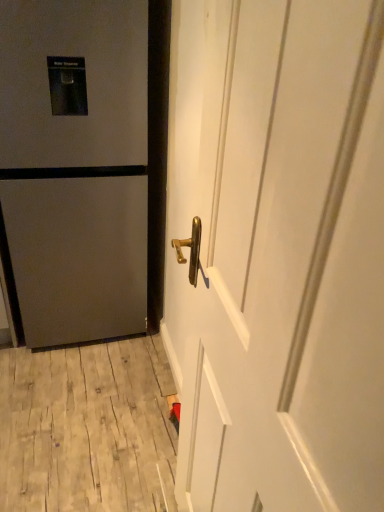
Find the location of a particular element. vacant space situated above wooden at lower left (from a real-world perspective) is located at coordinates (x=87, y=399).